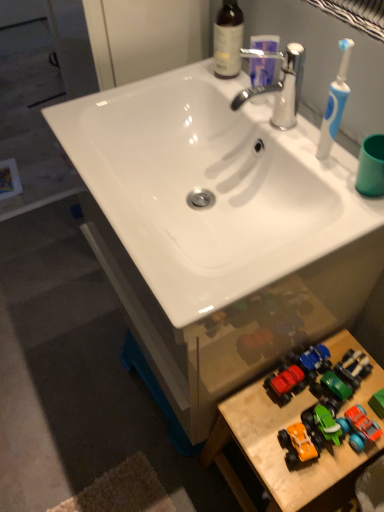
Where is `free space in front of brown glass bottle at upper center`? free space in front of brown glass bottle at upper center is located at coordinates (250, 100).